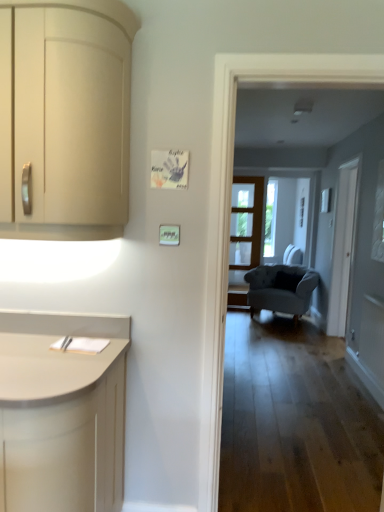
Question: In terms of height, does white glass screen door at right look taller or shorter compared to matte cream cabinet at left?

Choices:
 (A) short
 (B) tall

Answer: (B)

Question: Considering the positions of white glass screen door at right and matte cream cabinet at left in the image, is white glass screen door at right wider or thinner than matte cream cabinet at left?

Choices:
 (A) thin
 (B) wide

Answer: (A)

Question: Estimate the real-world distances between objects in this image. Which object is farther from the velvet grey armchair at center?

Choices:
 (A) matte cream cabinet at left
 (B) transparent glass window at upper right
 (C) clear glass door at center
 (D) gray fabric armchair at center
 (E) white glass screen door at right

Answer: (A)

Question: Considering the real-world distances, which object is farthest from the matte cream cabinet at left?

Choices:
 (A) velvet grey armchair at center
 (B) clear glass door at center
 (C) transparent glass window at upper right
 (D) gray fabric armchair at center
 (E) white glass screen door at right

Answer: (B)